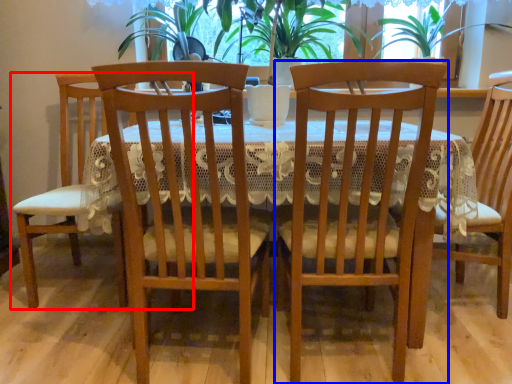
Question: Among these objects, which one is nearest to the camera, chair (highlighted by a red box) or chair (highlighted by a blue box)?

Choices:
 (A) chair
 (B) chair

Answer: (B)